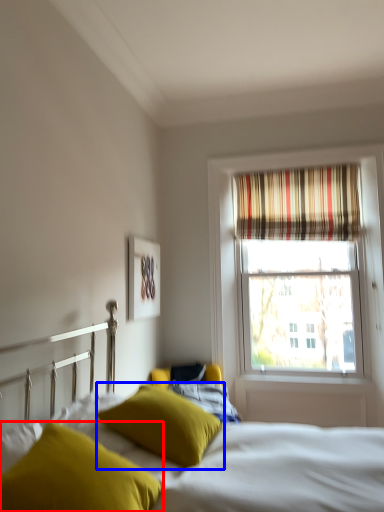
Question: Among these objects, which one is nearest to the camera, pillow (highlighted by a red box) or pillow (highlighted by a blue box)?

Choices:
 (A) pillow
 (B) pillow

Answer: (A)